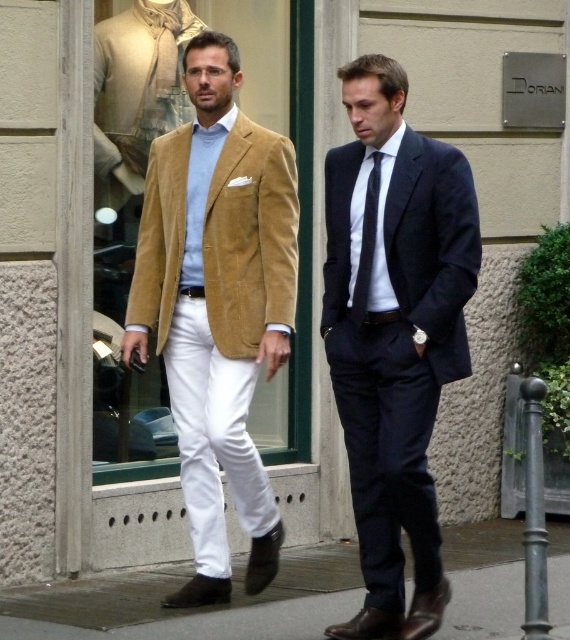
Question: Is matte navy suit at right further to camera compared to velvet gold jacket at left?

Choices:
 (A) yes
 (B) no

Answer: (B)

Question: Estimate the real-world distances between objects in this image. Which object is closer to the velvet gold blazer at center?

Choices:
 (A) smooth concrete pavement at lower center
 (B) velvet gold jacket at left

Answer: (B)

Question: Among these objects, which one is farthest from the camera?

Choices:
 (A) velvet gold blazer at center
 (B) velvet gold jacket at left

Answer: (B)

Question: Is velvet gold blazer at center bigger than velvet gold jacket at left?

Choices:
 (A) no
 (B) yes

Answer: (B)

Question: Which of the following is the closest to the observer?

Choices:
 (A) velvet gold jacket at left
 (B) velvet gold blazer at center
 (C) dark blue silk tie at center

Answer: (C)

Question: Considering the relative positions of smooth concrete pavement at lower center and dark blue silk tie at center in the image provided, where is smooth concrete pavement at lower center located with respect to dark blue silk tie at center?

Choices:
 (A) left
 (B) right

Answer: (B)